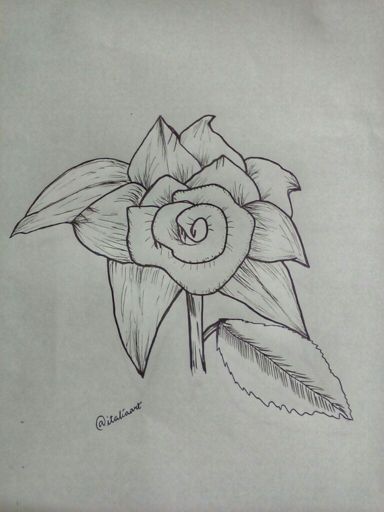
The height and width of the screenshot is (512, 384). Find the location of `left pedastals`. left pedastals is located at coordinates (82, 200).